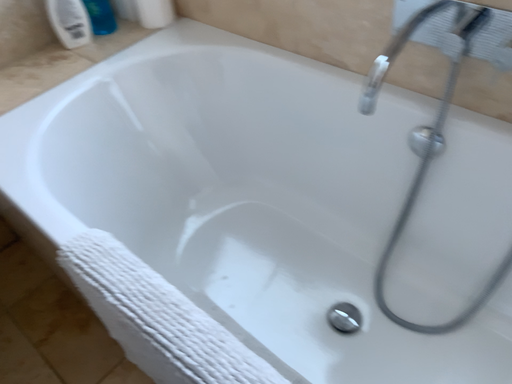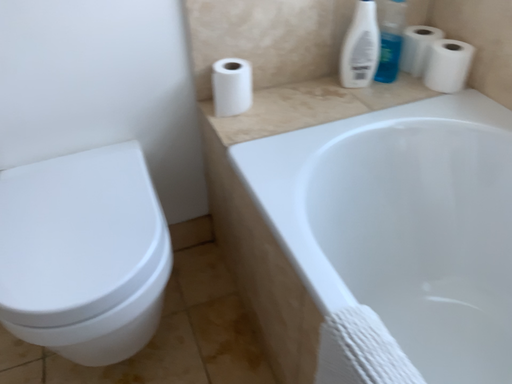
Question: Which way did the camera rotate in the video?

Choices:
 (A) rotated right
 (B) rotated left

Answer: (B)